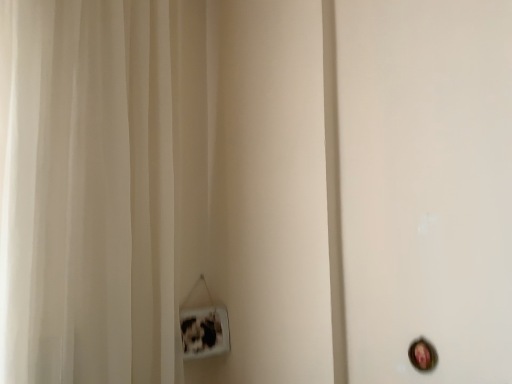
This screenshot has height=384, width=512. In order to click on white sheer curtain at left in this screenshot , I will do `click(101, 185)`.

What do you see at coordinates (101, 185) in the screenshot? The image size is (512, 384). I see `white sheer curtain at left` at bounding box center [101, 185].

This screenshot has height=384, width=512. In order to click on white sheer curtain at left in this screenshot , I will do `click(101, 185)`.